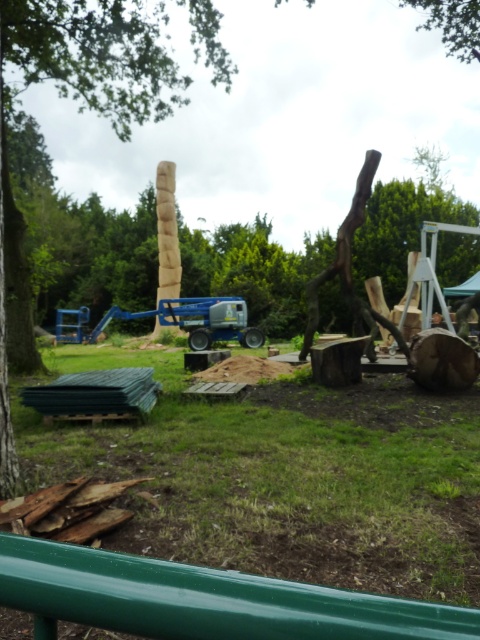
Does green grass at center have a greater height compared to brown rough tree trunk at left?

No.

Which of these two, green grass at center or brown rough tree trunk at left, stands shorter?

green grass at center is shorter.

Between point (74, 467) and point (12, 438), which one is positioned in front?

Positioned in front is point (12, 438).

You are a GUI agent. You are given a task and a screenshot of the screen. Output one action in this format:
    pyautogui.click(x=<x>, y=<y>)
    Task: Click on the green grass at center
    This screenshot has width=480, height=640.
    Given the screenshot: What is the action you would take?
    pyautogui.click(x=285, y=477)